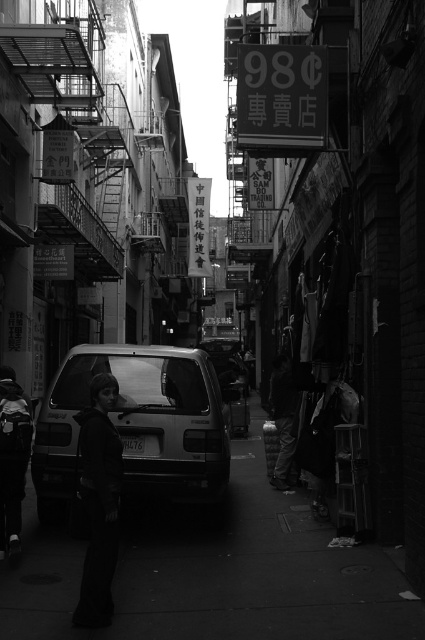
Question: Based on their relative distances, which object is nearer to the dark fabric jacket at center?

Choices:
 (A) metallic silver van at center
 (B) smooth concrete pavement at lower center

Answer: (A)

Question: Observing the image, what is the correct spatial positioning of dark fabric jacket at center in reference to dark gray hoodie at left?

Choices:
 (A) left
 (B) right

Answer: (B)

Question: Does smooth concrete pavement at lower center appear over metallic silver van at center?

Choices:
 (A) yes
 (B) no

Answer: (B)

Question: Is metallic silver van at center to the right of dark fabric pants at center from the viewer's perspective?

Choices:
 (A) no
 (B) yes

Answer: (A)

Question: Considering the real-world distances, which object is farthest from the metallic silver van at center?

Choices:
 (A) dark fabric pants at center
 (B) smooth concrete pavement at lower center

Answer: (A)

Question: Which object appears closest to the camera in this image?

Choices:
 (A) metallic silver van at center
 (B) dark fabric pants at center

Answer: (A)